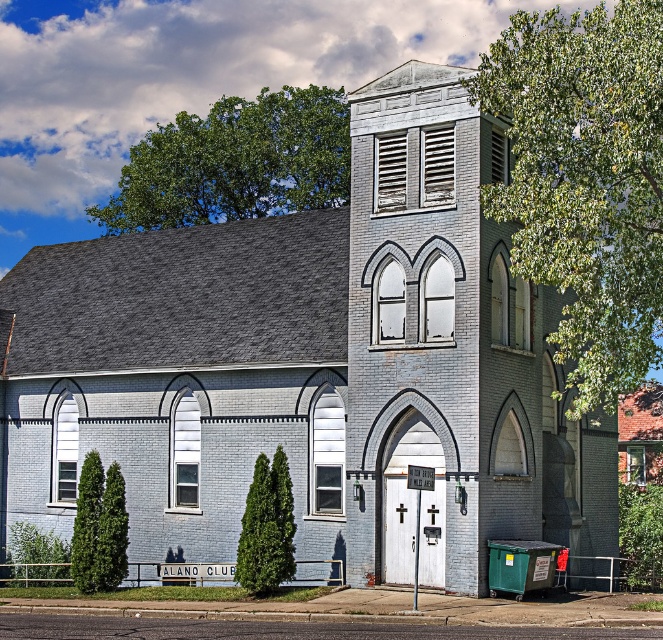
Is point (198, 186) positioned before point (272, 486)?

No, (198, 186) is further to viewer.

Is point (139, 164) closer to viewer compared to point (284, 561)?

No.

Where is `green leafy tree at upper center`? Image resolution: width=663 pixels, height=640 pixels. green leafy tree at upper center is located at coordinates (235, 163).

Based on the photo, can you confirm if green textured evergreen tree at center is positioned to the left of green textured tree at lower left?

No, green textured evergreen tree at center is not to the left of green textured tree at lower left.

Describe the element at coordinates (267, 528) in the screenshot. I see `green textured evergreen tree at center` at that location.

Does point (247, 528) come behind point (97, 563)?

No.

In order to click on green textured evergreen tree at center in this screenshot , I will do `click(267, 528)`.

Between green leafy tree at upper right and green leafy tree at upper center, which one has more height?

Standing taller between the two is green leafy tree at upper right.

Does green leafy tree at upper right have a lesser width compared to green leafy tree at upper center?

Yes, green leafy tree at upper right is thinner than green leafy tree at upper center.

The width and height of the screenshot is (663, 640). What do you see at coordinates (585, 182) in the screenshot?
I see `green leafy tree at upper right` at bounding box center [585, 182].

Find the location of `green leafy tree at upper right`. green leafy tree at upper right is located at coordinates (585, 182).